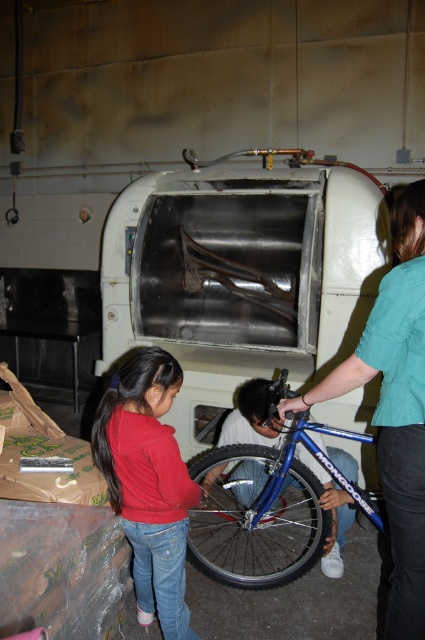
Question: Does blue metallic bicycle at center have a lesser width compared to teal fabric shirt at right?

Choices:
 (A) no
 (B) yes

Answer: (A)

Question: In this image, where is teal fabric shirt at right located relative to blue metallic tire at lower center?

Choices:
 (A) right
 (B) left

Answer: (A)

Question: Observing the image, what is the correct spatial positioning of teal fabric shirt at right in reference to blue metallic tire at lower center?

Choices:
 (A) above
 (B) below

Answer: (A)

Question: Which point appears closest to the camera in this image?

Choices:
 (A) (384, 358)
 (B) (252, 577)

Answer: (A)

Question: Among these objects, which one is farthest from the camera?

Choices:
 (A) blue metallic bicycle at center
 (B) blue metallic tire at lower center

Answer: (B)

Question: Which point is farther to the camera?

Choices:
 (A) (292, 497)
 (B) (223, 484)
 (C) (130, 483)

Answer: (A)